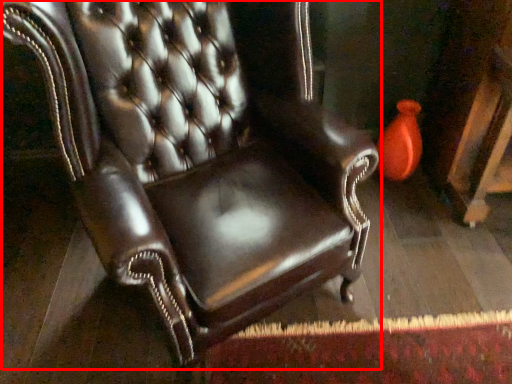
Question: In this image, where is chair (annotated by the red box) located relative to vase?

Choices:
 (A) right
 (B) left

Answer: (B)